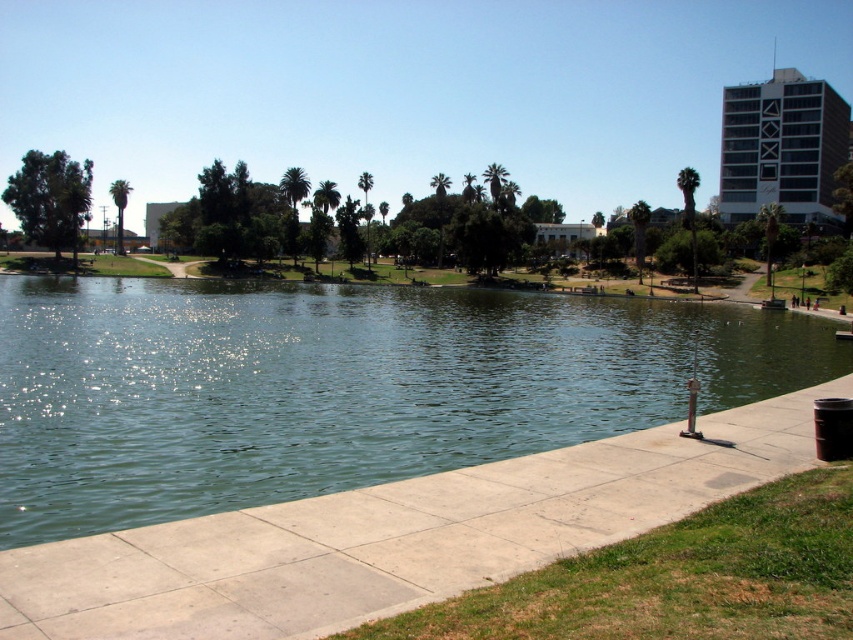
You are standing at the entrance of the park and want to locate the green concrete lake at center. According to the coordinates provided, where should you look relative to your current position?

The green concrete lake at center is located at coordinates point (337, 387), which means it is positioned to the right and slightly above your current position.

Looking at this image, you are standing at the edge of the green concrete lake at center and want to walk to the smooth concrete pavement at lower center. Which direction should you face to move towards it?

Since the smooth concrete pavement at lower center is positioned below the green concrete lake at center, you should face downward or southward to move towards it.